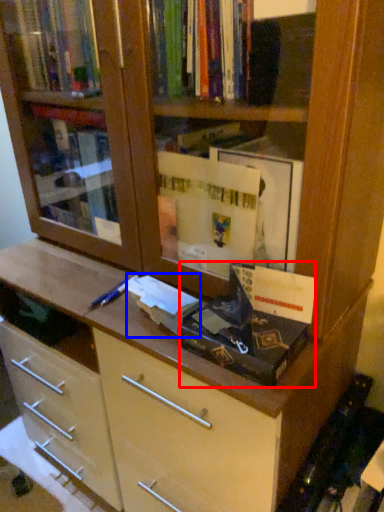
Question: Among these objects, which one is nearest to the camera, paperback book (highlighted by a red box) or paperback book (highlighted by a blue box)?

Choices:
 (A) paperback book
 (B) paperback book

Answer: (A)